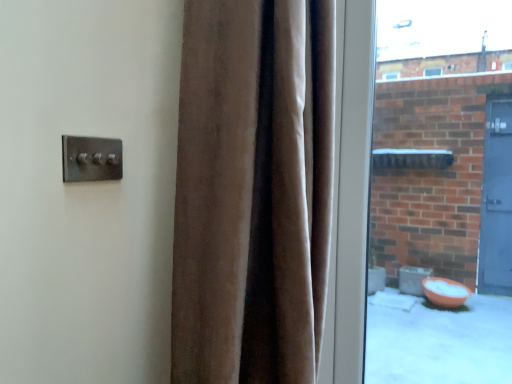
Question: Does clear glass window at right have a lesser width compared to velvet brown curtain at center?

Choices:
 (A) yes
 (B) no

Answer: (A)

Question: Is clear glass window at right aimed at velvet brown curtain at center?

Choices:
 (A) yes
 (B) no

Answer: (B)

Question: Is clear glass window at right positioned beyond the bounds of velvet brown curtain at center?

Choices:
 (A) no
 (B) yes

Answer: (B)

Question: From a real-world perspective, is clear glass window at right below velvet brown curtain at center?

Choices:
 (A) no
 (B) yes

Answer: (A)

Question: From a real-world perspective, is clear glass window at right over velvet brown curtain at center?

Choices:
 (A) yes
 (B) no

Answer: (A)

Question: Does clear glass window at right touch velvet brown curtain at center?

Choices:
 (A) yes
 (B) no

Answer: (B)

Question: From the image's perspective, would you say velvet brown curtain at center is positioned over clear glass window at right?

Choices:
 (A) no
 (B) yes

Answer: (A)

Question: From a real-world perspective, is velvet brown curtain at center on top of clear glass window at right?

Choices:
 (A) no
 (B) yes

Answer: (A)

Question: Is the depth of velvet brown curtain at center less than that of clear glass window at right?

Choices:
 (A) no
 (B) yes

Answer: (B)

Question: Is velvet brown curtain at center in contact with clear glass window at right?

Choices:
 (A) yes
 (B) no

Answer: (B)

Question: Can you confirm if velvet brown curtain at center is bigger than clear glass window at right?

Choices:
 (A) yes
 (B) no

Answer: (A)

Question: Does velvet brown curtain at center appear on the right side of clear glass window at right?

Choices:
 (A) yes
 (B) no

Answer: (B)

Question: Can velvet brown curtain at center be found inside satin silver switch at upper left?

Choices:
 (A) no
 (B) yes

Answer: (A)